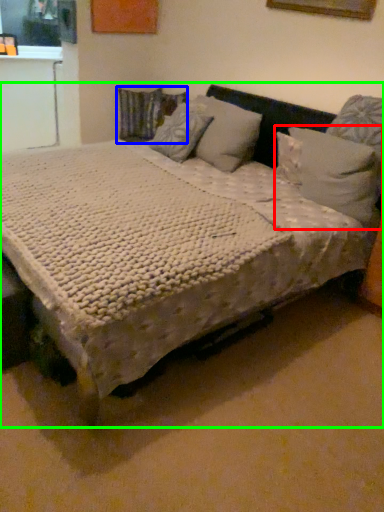
Question: Which object is positioned farthest from pillow (highlighted by a red box)? Select from pillow (highlighted by a blue box) and bed (highlighted by a green box).

Choices:
 (A) pillow
 (B) bed

Answer: (A)